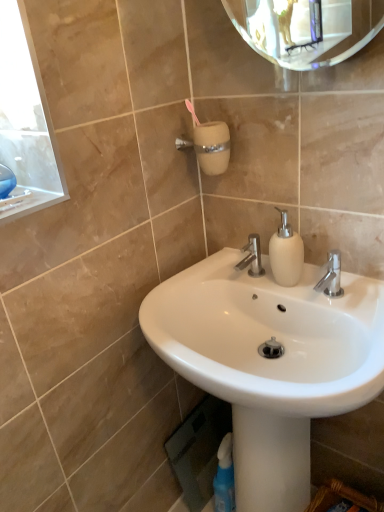
Question: Is white glossy sink at center completely or partially inside white matte soap dispenser at center?

Choices:
 (A) yes
 (B) no

Answer: (B)

Question: Is white matte soap dispenser at center closer to the viewer compared to white glossy sink at center?

Choices:
 (A) no
 (B) yes

Answer: (A)

Question: Is the surface of white matte soap dispenser at center in direct contact with white glossy sink at center?

Choices:
 (A) no
 (B) yes

Answer: (A)

Question: Does white matte soap dispenser at center have a larger size compared to white glossy sink at center?

Choices:
 (A) no
 (B) yes

Answer: (A)

Question: Does white matte soap dispenser at center lie behind white glossy sink at center?

Choices:
 (A) no
 (B) yes

Answer: (B)

Question: Is white matte soap dispenser at center shorter than white glossy sink at center?

Choices:
 (A) yes
 (B) no

Answer: (A)

Question: Does white matte soap dispenser at center have a larger size compared to polished chrome faucet at center?

Choices:
 (A) yes
 (B) no

Answer: (A)

Question: Are white matte soap dispenser at center and polished chrome faucet at center located far from each other?

Choices:
 (A) no
 (B) yes

Answer: (A)

Question: Is white matte soap dispenser at center thinner than polished chrome faucet at center?

Choices:
 (A) no
 (B) yes

Answer: (B)

Question: Is white matte soap dispenser at center touching polished chrome faucet at center?

Choices:
 (A) yes
 (B) no

Answer: (B)

Question: Does white matte soap dispenser at center come in front of polished chrome faucet at center?

Choices:
 (A) no
 (B) yes

Answer: (B)

Question: Does white matte soap dispenser at center have a greater height compared to polished chrome faucet at center?

Choices:
 (A) no
 (B) yes

Answer: (B)

Question: From a real-world perspective, is white glossy sink at center over white matte soap dispenser at center?

Choices:
 (A) yes
 (B) no

Answer: (B)